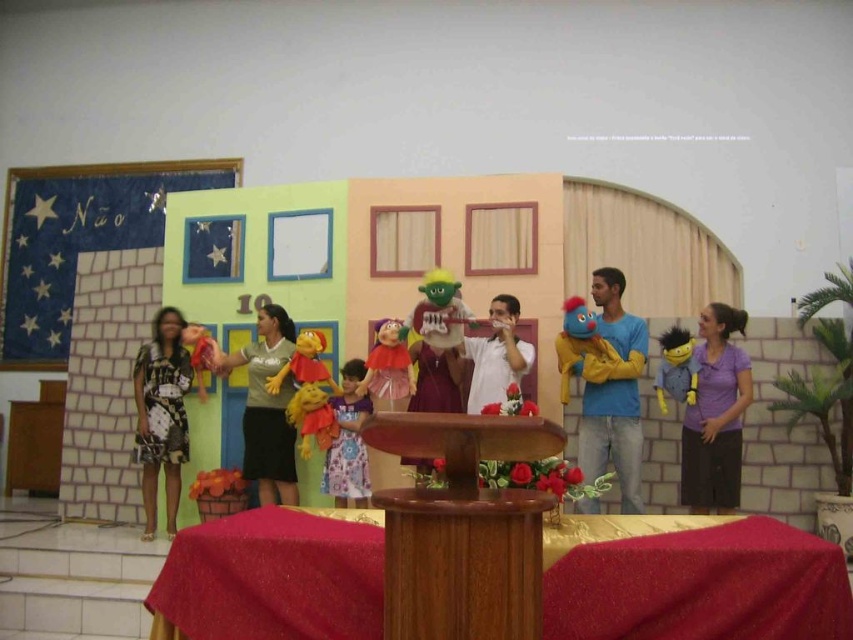
Question: Does brown polished wood podium at center appear over velvet plush puppet at center?

Choices:
 (A) no
 (B) yes

Answer: (A)

Question: Can you confirm if yellow plush puppet at center is positioned above matte red puppet at left?

Choices:
 (A) yes
 (B) no

Answer: (B)

Question: Estimate the real-world distances between objects in this image. Which object is closer to the matte red puppet at left?

Choices:
 (A) velvet plush puppet at center
 (B) purple floral dress at center
 (C) blue plush puppet at center
 (D) blue plush puppet at right

Answer: (A)

Question: Which of the following is the farthest from the observer?

Choices:
 (A) (268, 412)
 (B) (432, 284)
 (C) (672, 333)

Answer: (A)

Question: Does blue cotton shirt at right appear on the left side of matte red puppet at center?

Choices:
 (A) yes
 (B) no

Answer: (B)

Question: Considering the real-world distances, which object is closest to the yellow plush puppet at center?

Choices:
 (A) velvet plush puppet at center
 (B) purple cotton shirt at right
 (C) matte red puppet at center
 (D) black printed dress at left

Answer: (A)